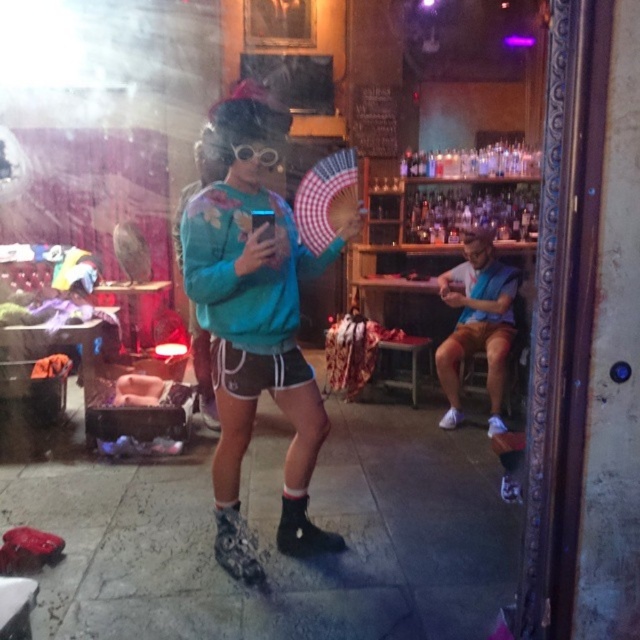
I want to click on blue fabric shirt at right, so click(x=477, y=324).

Who is more forward, (449, 384) or (252, 148)?

Positioned in front is point (252, 148).

This screenshot has width=640, height=640. In order to click on blue fabric shirt at right in this screenshot , I will do `click(477, 324)`.

Is teal fabric sweatshirt at center to the left of clear plastic goggles at center from the viewer's perspective?

In fact, teal fabric sweatshirt at center is to the right of clear plastic goggles at center.

Does point (262, 252) come closer to viewer compared to point (244, 148)?

Yes, point (262, 252) is in front of point (244, 148).

Locate an element on the screen. Image resolution: width=640 pixels, height=640 pixels. teal fabric sweatshirt at center is located at coordinates (253, 324).

Does point (212, 480) come behind point (497, 358)?

No.

Is point (314, 275) closer to viewer compared to point (477, 307)?

Yes, point (314, 275) is closer to viewer.

Image resolution: width=640 pixels, height=640 pixels. Find the location of `teal fabric sweatshirt at center`. teal fabric sweatshirt at center is located at coordinates (253, 324).